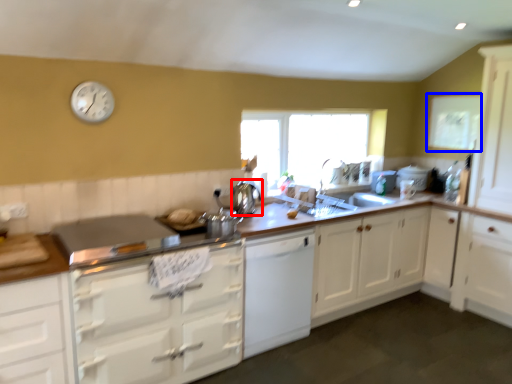
Question: Among these objects, which one is farthest to the camera, kitchen appliance (highlighted by a red box) or window screen (highlighted by a blue box)?

Choices:
 (A) kitchen appliance
 (B) window screen

Answer: (B)